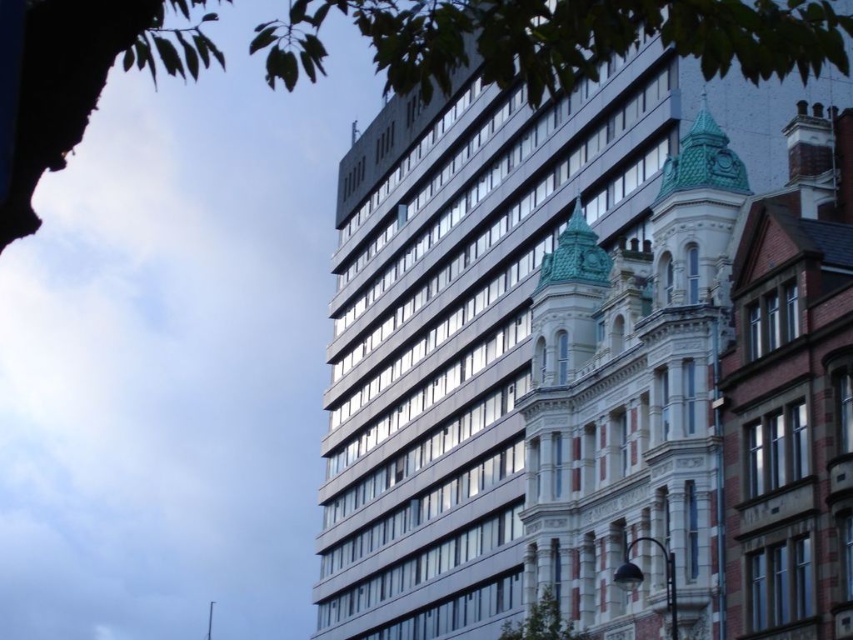
Is point (514, 282) in front of point (584, 227)?

No.

Does point (657, 440) lie behind point (730, 248)?

Yes, it is behind point (730, 248).

The width and height of the screenshot is (853, 640). Identify the location of metallic glass building at upper center. (529, 340).